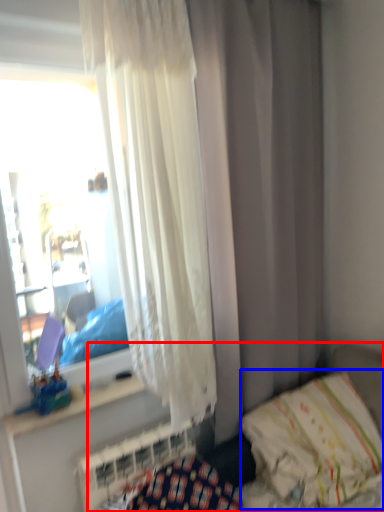
Question: Which of the following is the closest to the observer, hospital bed (highlighted by a red box) or pillow (highlighted by a blue box)?

Choices:
 (A) hospital bed
 (B) pillow

Answer: (A)